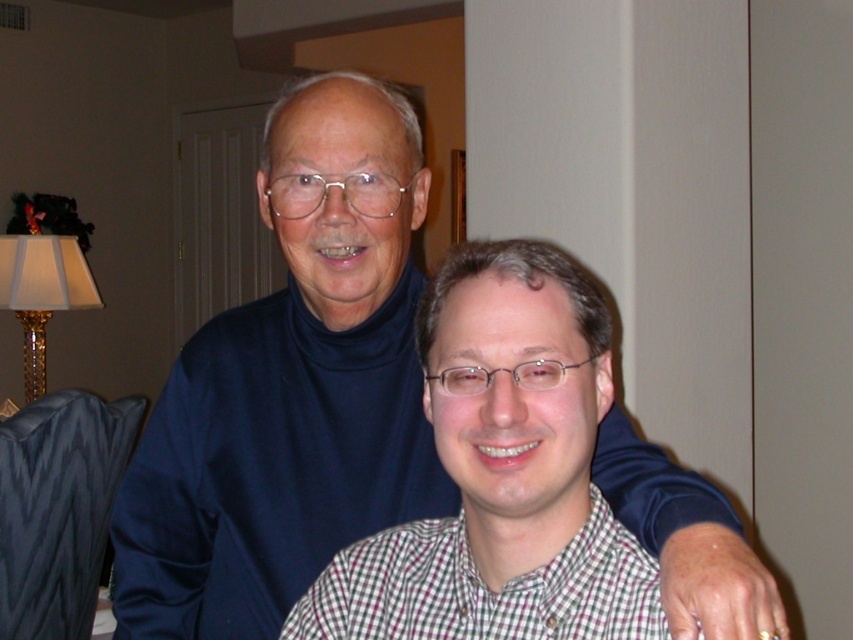
Where is `dark blue turtleneck sweater at upper center`? The width and height of the screenshot is (853, 640). dark blue turtleneck sweater at upper center is located at coordinates (289, 388).

Does dark blue turtleneck sweater at upper center have a larger size compared to checkered shirt at center?

Indeed, dark blue turtleneck sweater at upper center has a larger size compared to checkered shirt at center.

Is point (706, 538) in front of point (495, 424)?

No, it is not.

I want to click on dark blue turtleneck sweater at upper center, so click(x=289, y=388).